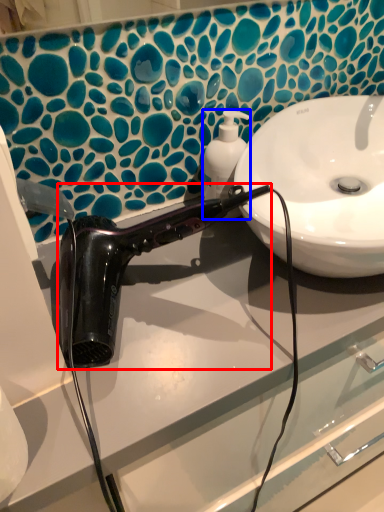
Question: Which of the following is the closest to the observer, hair dryer (highlighted by a red box) or soap dispenser (highlighted by a blue box)?

Choices:
 (A) hair dryer
 (B) soap dispenser

Answer: (A)